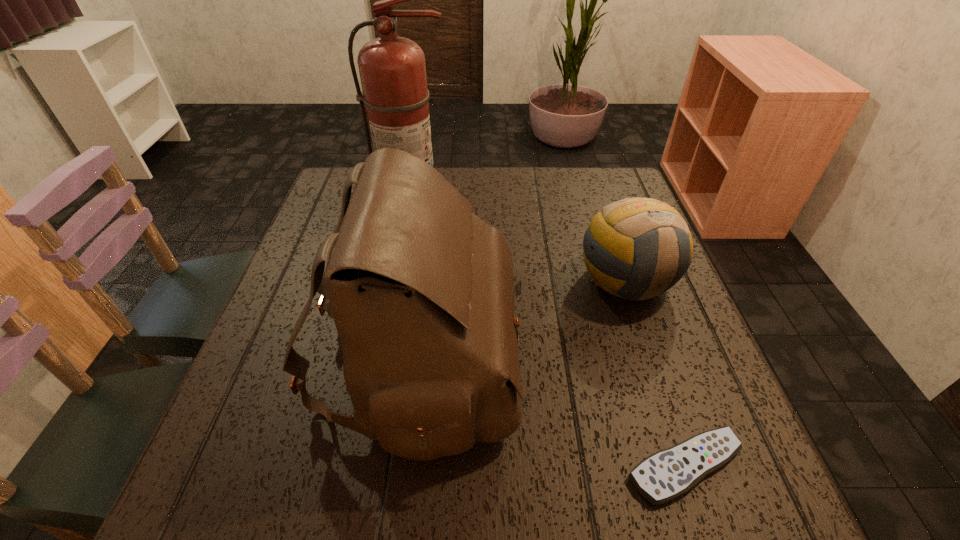
The height and width of the screenshot is (540, 960). I want to click on vacant space that satisfies the following two spatial constraints: 1. on the front flap of the satchel; 2. on the back side of the shortest object, so click(405, 466).

Locate an element on the screen. Image resolution: width=960 pixels, height=540 pixels. free spot that satisfies the following two spatial constraints: 1. on the front-facing side of the remote control; 2. on the right side of the tallest object is located at coordinates (365, 466).